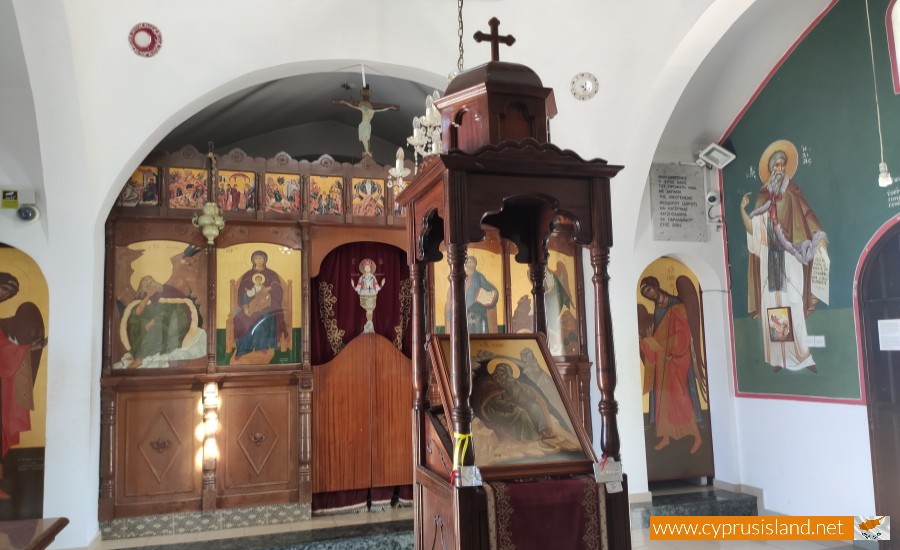
Image resolution: width=900 pixels, height=550 pixels. What are the coordinates of `white paint` in the screenshot? It's located at (707, 88), (812, 465), (714, 352), (243, 57), (14, 133), (58, 102).